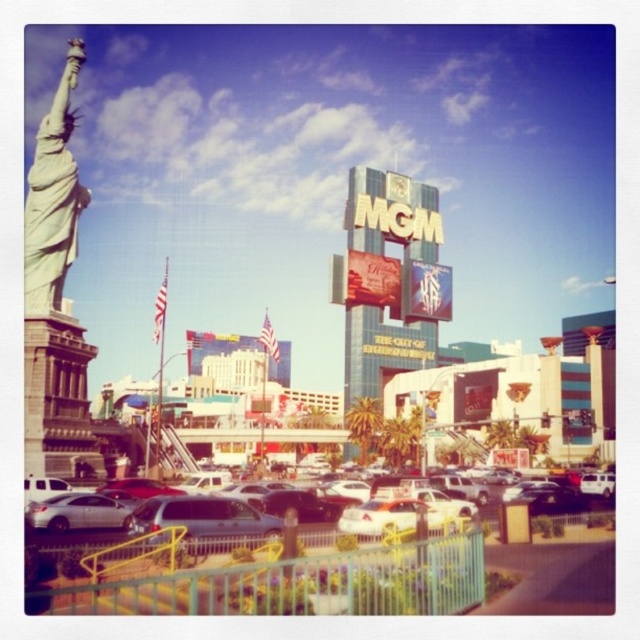
Who is higher up, silver metallic sedan at center or white marble statue at left?

white marble statue at left is higher up.

How much distance is there between silver metallic sedan at center and white marble statue at left?

silver metallic sedan at center and white marble statue at left are 31.66 meters apart from each other.

Does point (486, 499) lie behind point (54, 172)?

Yes, point (486, 499) is farther from viewer.

Where is `silver metallic sedan at center`? This screenshot has height=640, width=640. silver metallic sedan at center is located at coordinates (316, 497).